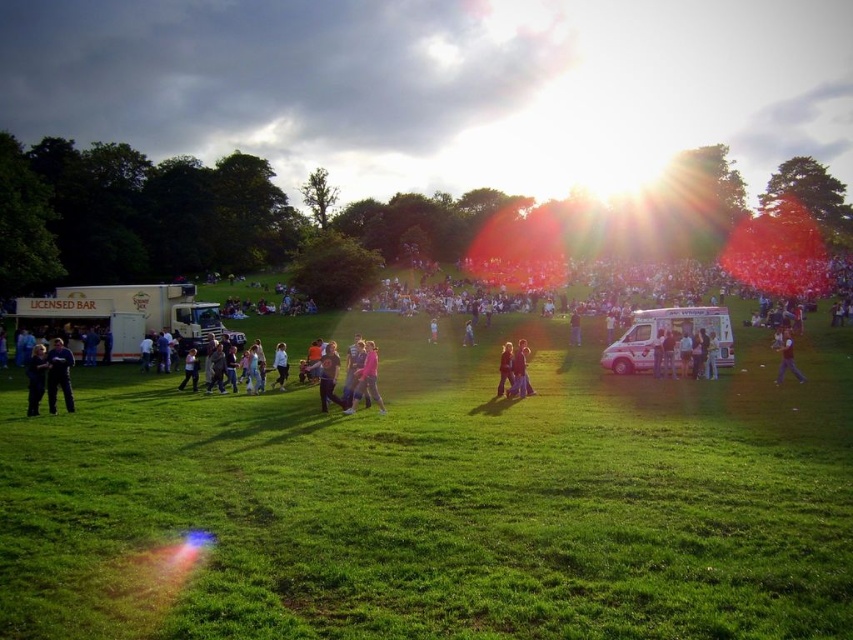
Can you confirm if matte pink jacket at center is smaller than pink fabric dress at center?

Indeed, matte pink jacket at center has a smaller size compared to pink fabric dress at center.

Based on the photo, which of these two, matte pink jacket at center or pink fabric dress at center, stands shorter?

pink fabric dress at center

The width and height of the screenshot is (853, 640). Describe the element at coordinates (505, 369) in the screenshot. I see `matte pink jacket at center` at that location.

The height and width of the screenshot is (640, 853). I want to click on matte pink jacket at center, so click(x=505, y=369).

Is point (689, 506) less distant than point (36, 360)?

Yes, point (689, 506) is closer to viewer.

Who is more distant from viewer, (813, 445) or (32, 413)?

Point (32, 413)

Between point (625, 397) and point (44, 384), which one is positioned behind?

Positioned behind is point (625, 397).

Where is `green grassy field at center`? The width and height of the screenshot is (853, 640). green grassy field at center is located at coordinates (438, 502).

Can you confirm if white metallic truck at left is positioned above dark blue jeans at lower right?

Correct, white metallic truck at left is located above dark blue jeans at lower right.

Is white metallic truck at left thinner than dark blue jeans at lower right?

Incorrect, white metallic truck at left's width is not less than dark blue jeans at lower right's.

Identify the location of white metallic truck at left. (125, 316).